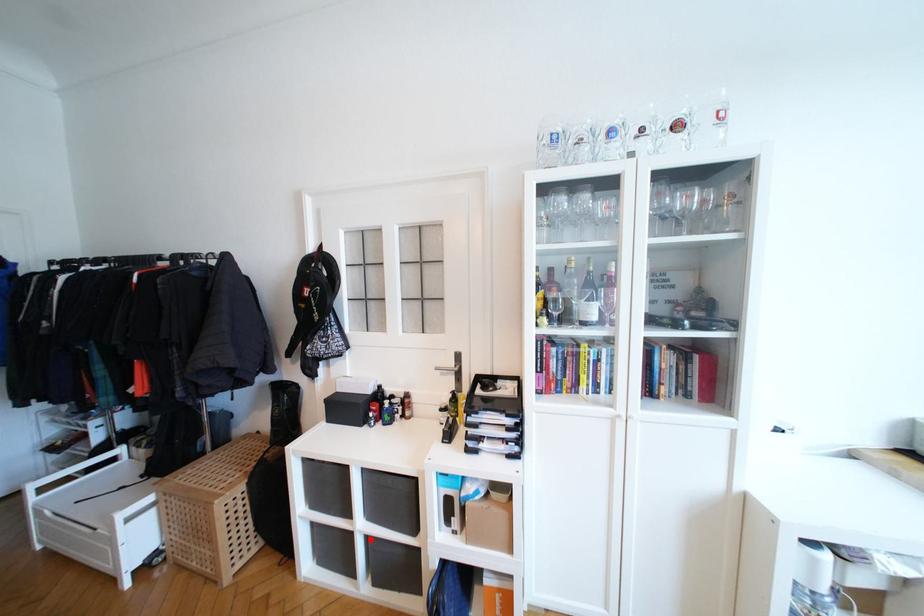
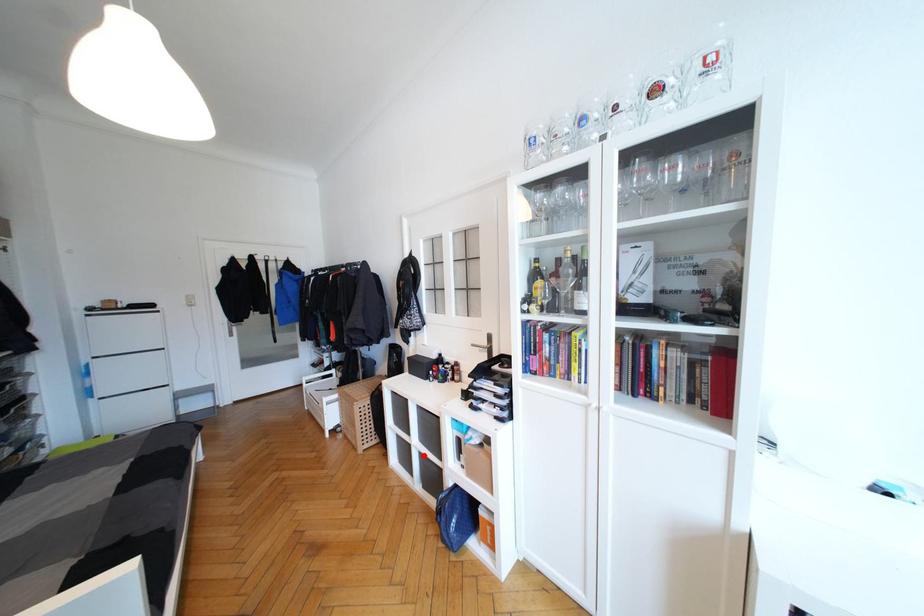
I am providing you with two images of the same scene from different viewpoints. A red point is marked on the first image and another point is marked on the second image. Does the point marked in image1 correspond to the same location as the one in image2?

Yes